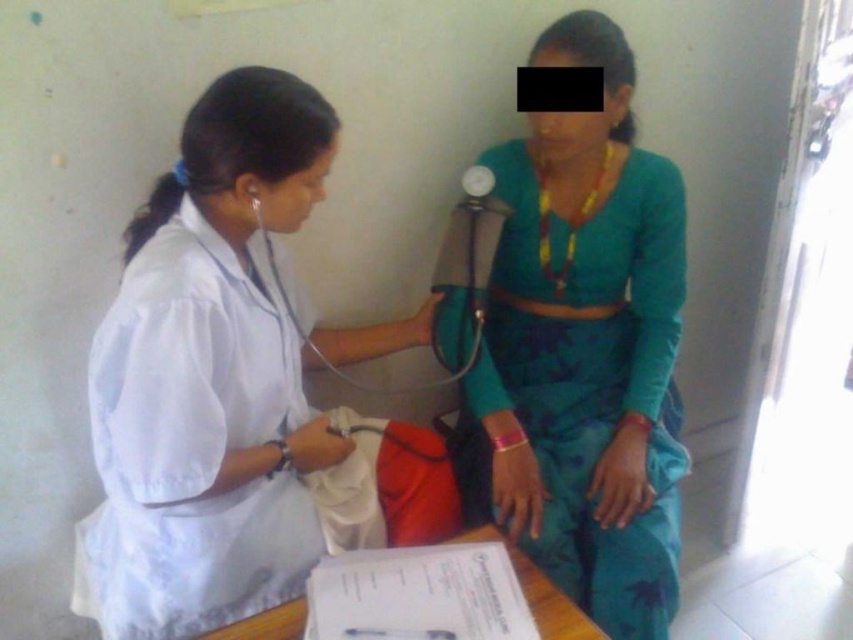
Can you confirm if white matte lab coat at center is taller than teal fabric dress at center?

No, white matte lab coat at center is not taller than teal fabric dress at center.

Looking at this image, does white matte lab coat at center come in front of teal fabric dress at center?

Yes, it is in front of teal fabric dress at center.

Is point (194, 227) less distant than point (556, 484)?

Yes.

Identify the location of white matte lab coat at center. The height and width of the screenshot is (640, 853). (x=236, y=388).